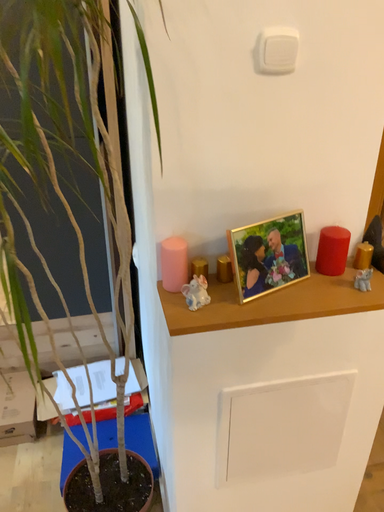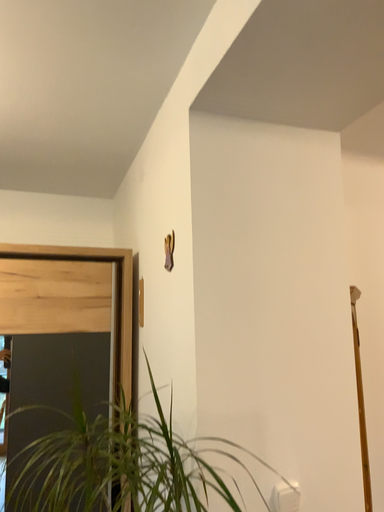
Question: Which way did the camera rotate in the video?

Choices:
 (A) rotated right
 (B) rotated left

Answer: (A)